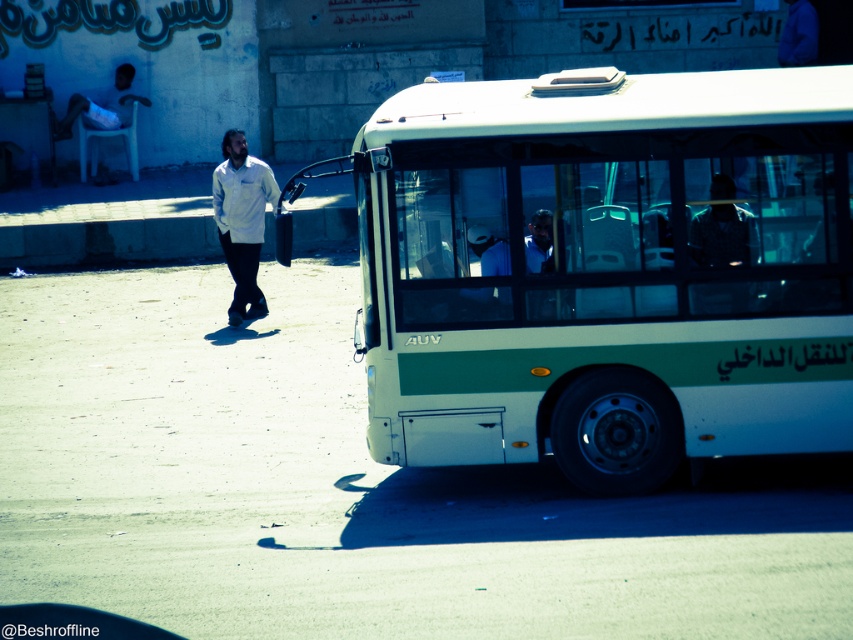
Question: Is white matte bus at center below white matte shirt at center?

Choices:
 (A) no
 (B) yes

Answer: (B)

Question: Which object is farther from the camera taking this photo?

Choices:
 (A) white matte shirt at center
 (B) white matte bus at center

Answer: (A)

Question: Is white matte bus at center below white matte shirt at center?

Choices:
 (A) no
 (B) yes

Answer: (B)

Question: Does white matte bus at center appear on the right side of white matte shirt at center?

Choices:
 (A) no
 (B) yes

Answer: (B)

Question: Which point is farther to the camera?

Choices:
 (A) (256, 227)
 (B) (752, 152)

Answer: (A)